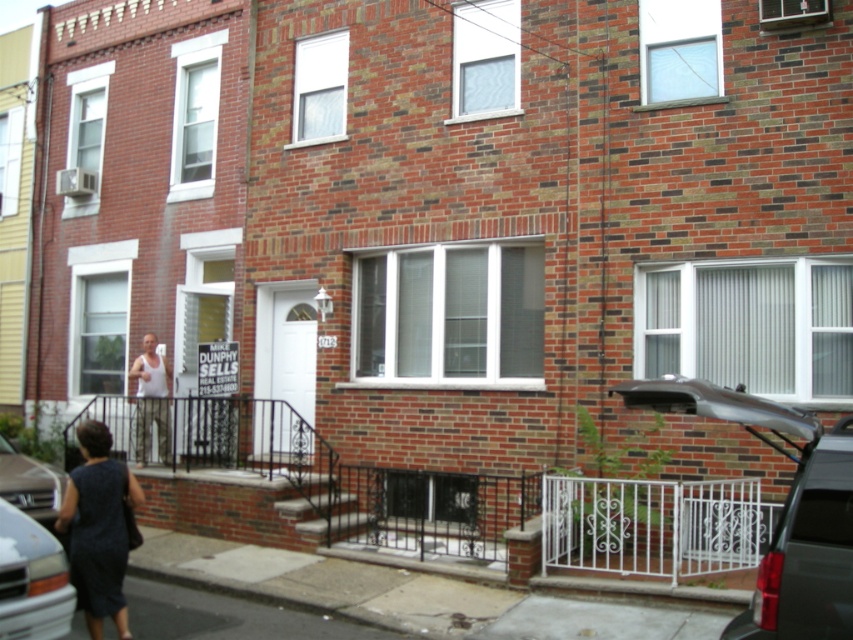
Where is `matte black car at right`? matte black car at right is located at coordinates (782, 509).

Is matte black car at right to the left of dark gray dress at lower left from the viewer's perspective?

Incorrect, matte black car at right is not on the left side of dark gray dress at lower left.

Who is more distant from viewer, (828, 579) or (119, 588)?

The point (119, 588) is more distant.

Where is `matte black car at right`? matte black car at right is located at coordinates (782, 509).

Which of these two, silver metallic sedan at lower left or white tank top at center, stands taller?

white tank top at center

Is point (61, 484) more distant than point (146, 428)?

No, it is not.

I want to click on silver metallic sedan at lower left, so click(30, 483).

Between point (100, 532) and point (7, 541), which one is positioned in front?

Point (7, 541)

Is dark gray dress at lower left wider than silver metallic van at lower left?

In fact, dark gray dress at lower left might be narrower than silver metallic van at lower left.

The height and width of the screenshot is (640, 853). In order to click on dark gray dress at lower left in this screenshot , I will do `click(97, 529)`.

Where is `dark gray dress at lower left`? dark gray dress at lower left is located at coordinates (97, 529).